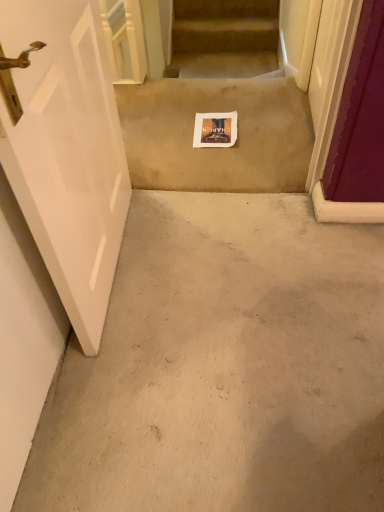
What do you see at coordinates (220, 104) in the screenshot? The width and height of the screenshot is (384, 512). I see `beige carpet at center` at bounding box center [220, 104].

Locate an element on the screen. beige carpet at center is located at coordinates pyautogui.click(x=220, y=104).

Locate an element on the screen. The image size is (384, 512). white glossy door at left is located at coordinates (67, 152).

Image resolution: width=384 pixels, height=512 pixels. What do you see at coordinates (67, 152) in the screenshot?
I see `white glossy door at left` at bounding box center [67, 152].

You are a GUI agent. You are given a task and a screenshot of the screen. Output one action in this format:
    pyautogui.click(x=<x>, y=<y>)
    Task: Click on the beige carpet at center
    
    Given the screenshot: What is the action you would take?
    pyautogui.click(x=220, y=104)

Does white glossy door at left appear on the left side of beige carpet at center?

Yes, white glossy door at left is to the left of beige carpet at center.

Is white glossy door at left positioned in front of beige carpet at center?

Yes, white glossy door at left is closer to the viewer.

Is point (28, 116) closer or farther from the camera than point (139, 132)?

Point (28, 116).

From the image's perspective, which object appears higher, white glossy door at left or beige carpet at center?

beige carpet at center is shown above in the image.

From a real-world perspective, which object stands above the other?

From a 3D spatial view, white glossy door at left is above.

Looking at their sizes, would you say white glossy door at left is wider or thinner than beige carpet at center?

Considering their sizes, white glossy door at left looks slimmer than beige carpet at center.

Who is shorter, white glossy door at left or beige carpet at center?

Standing shorter between the two is beige carpet at center.

Is white glossy door at left smaller than beige carpet at center?

Actually, white glossy door at left might be larger than beige carpet at center.

Is beige carpet at center surrounded by white glossy door at left?

No.

Would you say white glossy door at left is a long distance from beige carpet at center?

white glossy door at left is near beige carpet at center, not far away.

Does white glossy door at left turn towards beige carpet at center?

No, white glossy door at left does not turn towards beige carpet at center.

The image size is (384, 512). In order to click on escalator behind the white glossy door at left in this screenshot , I will do `click(220, 104)`.

Is beige carpet at center to the right of white glossy door at left from the viewer's perspective?

Indeed, beige carpet at center is positioned on the right side of white glossy door at left.

Based on the photo, is the depth of beige carpet at center less than that of white glossy door at left?

That is False.

Which point is more forward, (209, 186) or (5, 4)?

The point (5, 4) is in front.

From the image's perspective, relative to white glossy door at left, is beige carpet at center above or below?

From the image's perspective, beige carpet at center appears above white glossy door at left.

From a real-world perspective, which object rests below the other?

beige carpet at center.

From the picture: Considering the relative sizes of beige carpet at center and white glossy door at left in the image provided, is beige carpet at center thinner than white glossy door at left?

Incorrect, the width of beige carpet at center is not less than that of white glossy door at left.

In terms of height, does beige carpet at center look taller or shorter compared to white glossy door at left?

beige carpet at center is shorter than white glossy door at left.

Considering the sizes of beige carpet at center and white glossy door at left in the image, is beige carpet at center bigger or smaller than white glossy door at left?

Clearly, beige carpet at center is smaller in size than white glossy door at left.

Based on the photo, is beige carpet at center situated inside white glossy door at left or outside?

beige carpet at center lies outside white glossy door at left.

Are beige carpet at center and white glossy door at left located far from each other?

No.

Consider the image. Does beige carpet at center turn towards white glossy door at left?

No, beige carpet at center is not facing towards white glossy door at left.

The width and height of the screenshot is (384, 512). Find the location of `door in front of the beige carpet at center`. door in front of the beige carpet at center is located at coordinates (67, 152).

You are a GUI agent. You are given a task and a screenshot of the screen. Output one action in this format:
    pyautogui.click(x=<x>, y=<y>)
    Task: Click on the escalator that is on the right side of white glossy door at left
    This screenshot has width=384, height=512.
    Given the screenshot: What is the action you would take?
    pyautogui.click(x=220, y=104)

Locate an element on the screen. Image resolution: width=384 pixels, height=512 pixels. escalator that appears above the white glossy door at left (from the image's perspective) is located at coordinates (220, 104).